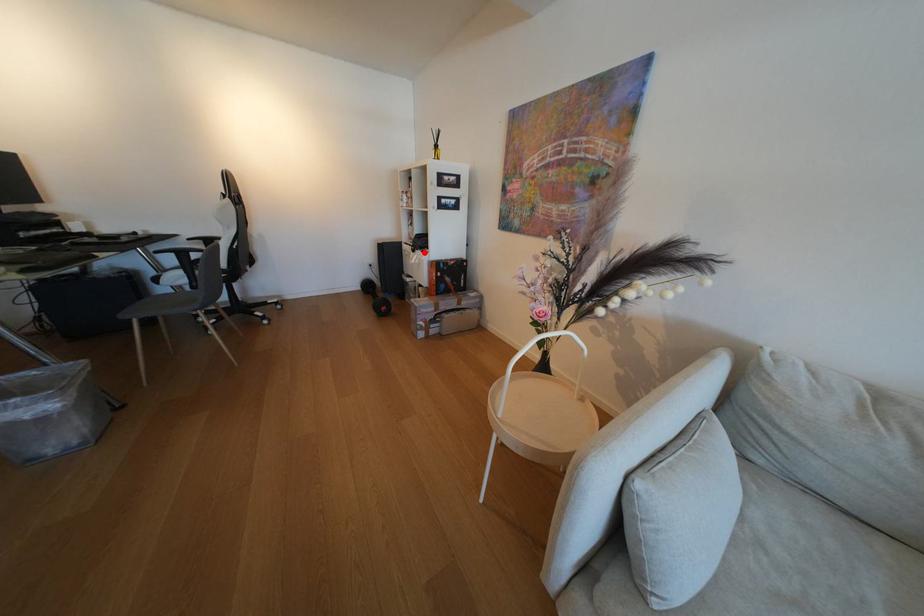
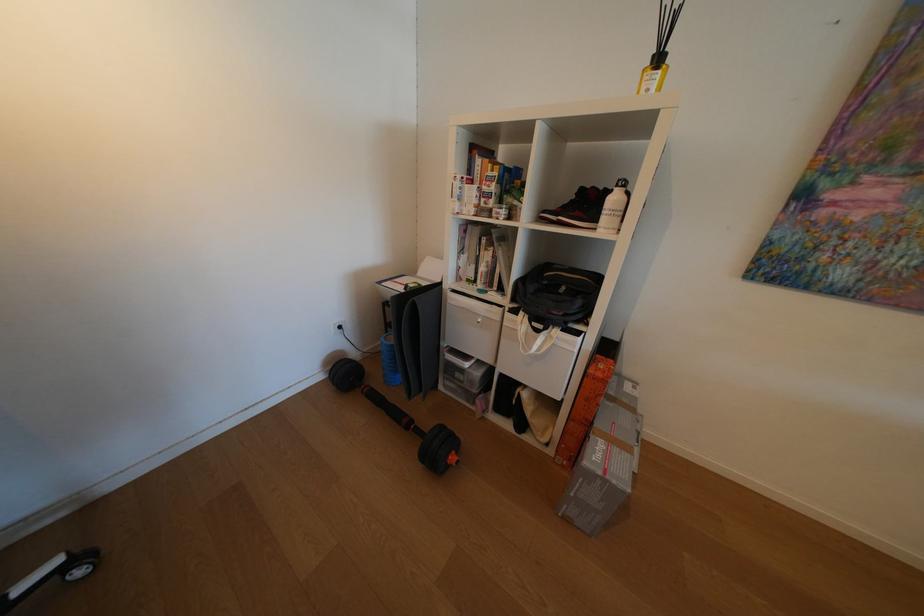
Find the pixel in the second image that matches the highlighted location in the first image.

(548, 331)